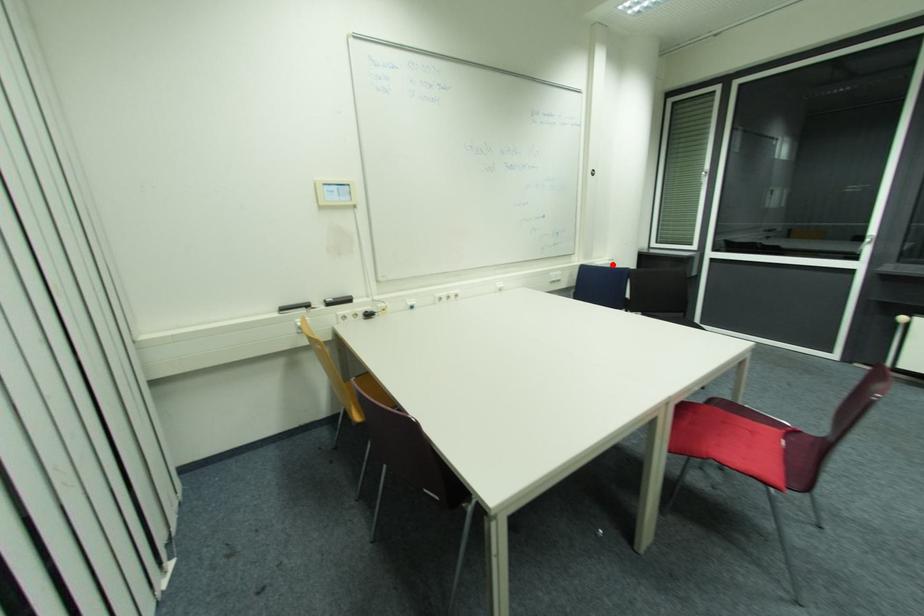
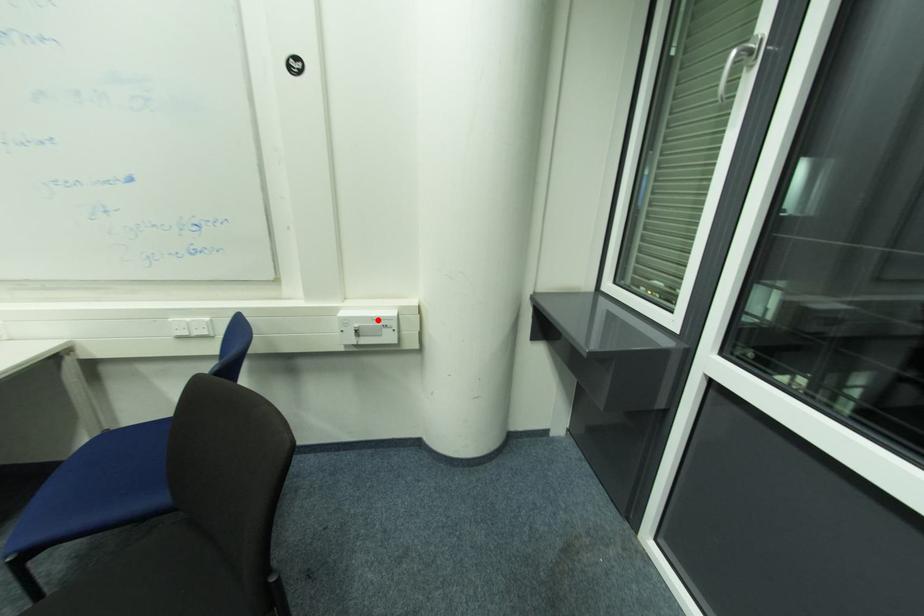
I am providing you with two images of the same scene from different viewpoints. A red point is marked on the first image and another point is marked on the second image. Is the red point in image1 aligned with the point shown in image2?

Yes